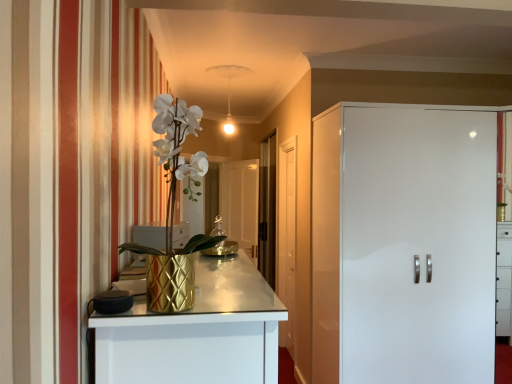
Question: Relative to white glossy cabinet at right, positioned as the first door in front-to-back order, is white wooden door at center, the second door from the front, in front or behind?

Choices:
 (A) front
 (B) behind

Answer: (B)

Question: From the image's perspective, is white wooden door at center, which is the first door from left to right, above or below white glossy cabinet at right, positioned as the first door in front-to-back order?

Choices:
 (A) above
 (B) below

Answer: (B)

Question: Estimate the real-world distances between objects in this image. Which object is closer to the gold textured vase at left?

Choices:
 (A) white glossy cabinet at right, which appears as the 2th door when viewed from the back
 (B) transparent glass door at center, the 1th glass door positioned from the left
 (C) transparent glass door at center, acting as the first glass door starting from the right
 (D) white wooden door at center, which appears as the first door when viewed from the back

Answer: (A)

Question: Estimate the real-world distances between objects in this image. Which object is farther from the white wooden door at center, placed as the second door when sorted from right to left?

Choices:
 (A) gold textured vase at left
 (B) transparent glass door at center, the 1th glass door positioned from the left
 (C) transparent glass door at center, acting as the first glass door starting from the right
 (D) white glossy cabinet at right, which appears as the 2th door when viewed from the back

Answer: (A)